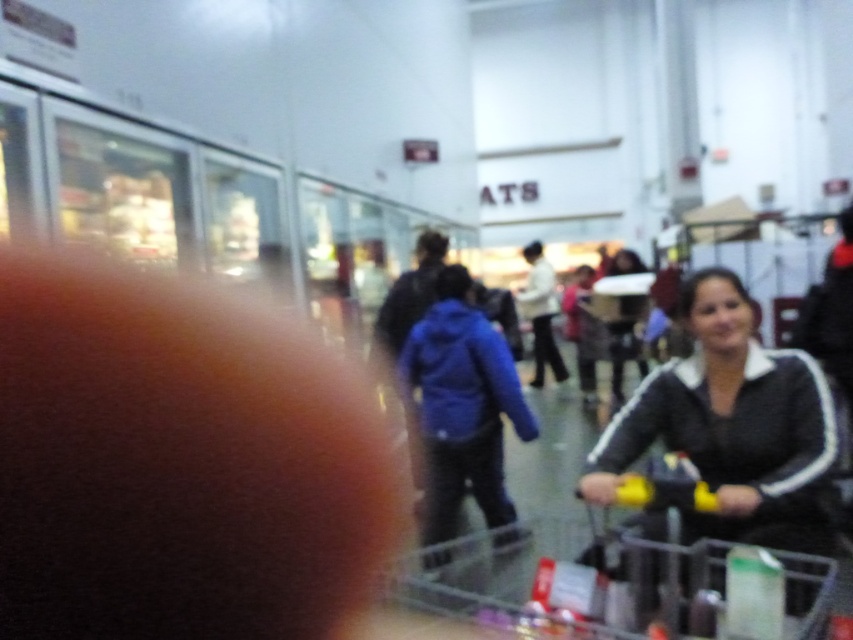
Question: Which point is farther to the camera?

Choices:
 (A) (554, 557)
 (B) (704, 275)

Answer: (A)

Question: Does black matte jacket at lower right appear under clear plastic shopping cart at lower right?

Choices:
 (A) no
 (B) yes

Answer: (A)

Question: Does black matte jacket at lower right have a smaller size compared to clear plastic shopping cart at lower right?

Choices:
 (A) no
 (B) yes

Answer: (B)

Question: Is black matte jacket at lower right bigger than clear plastic shopping cart at lower right?

Choices:
 (A) no
 (B) yes

Answer: (A)